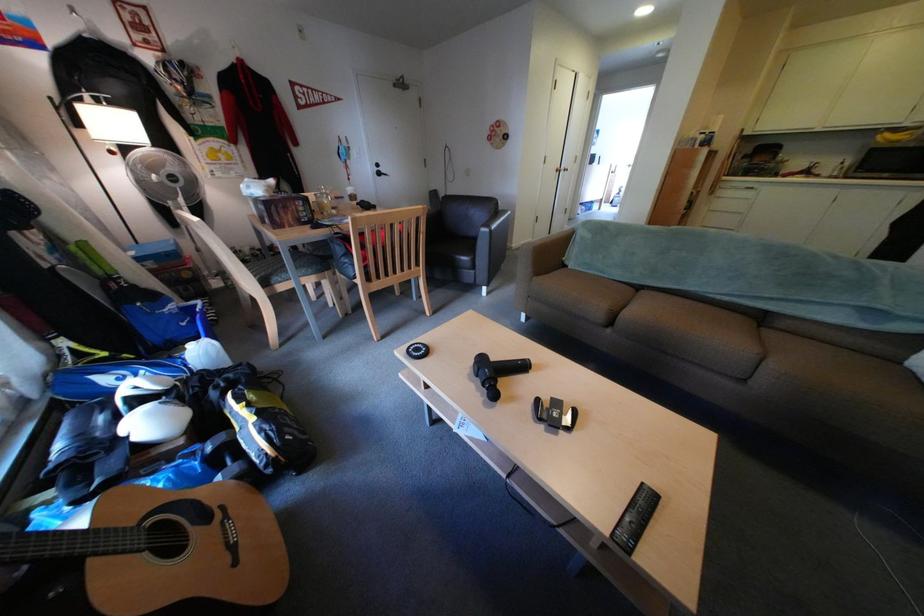
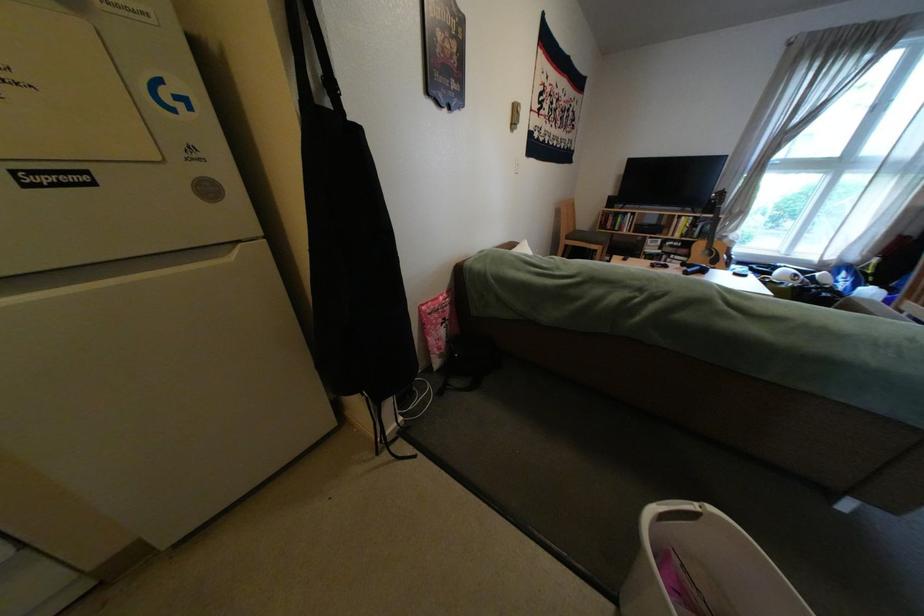
Question: I am providing you with two images of the same scene from different viewpoints. Which of the following objects are not visible in image2?

Choices:
 (A) pink food bag
 (B) black bag strap
 (C) white plastic jug
 (D) drawer pull

Answer: (C)